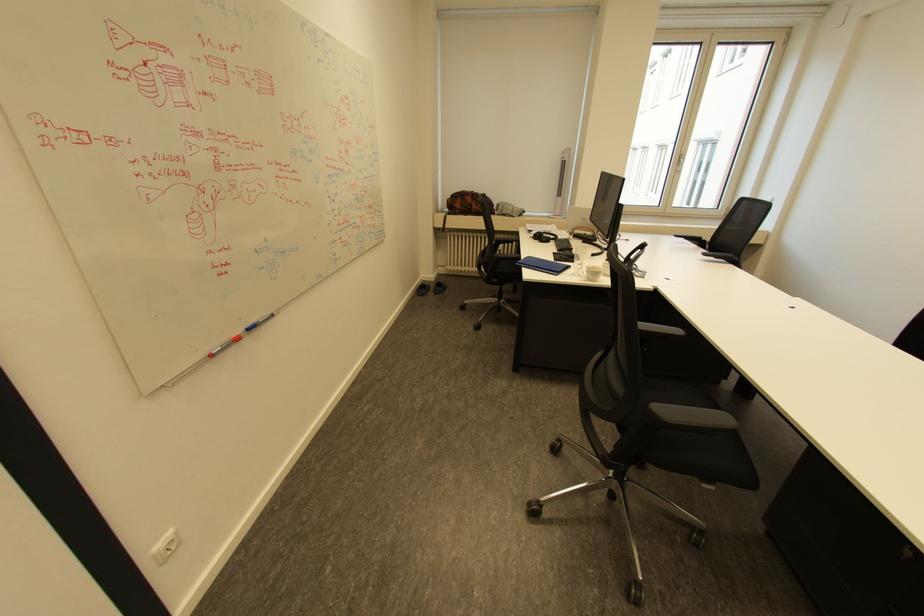
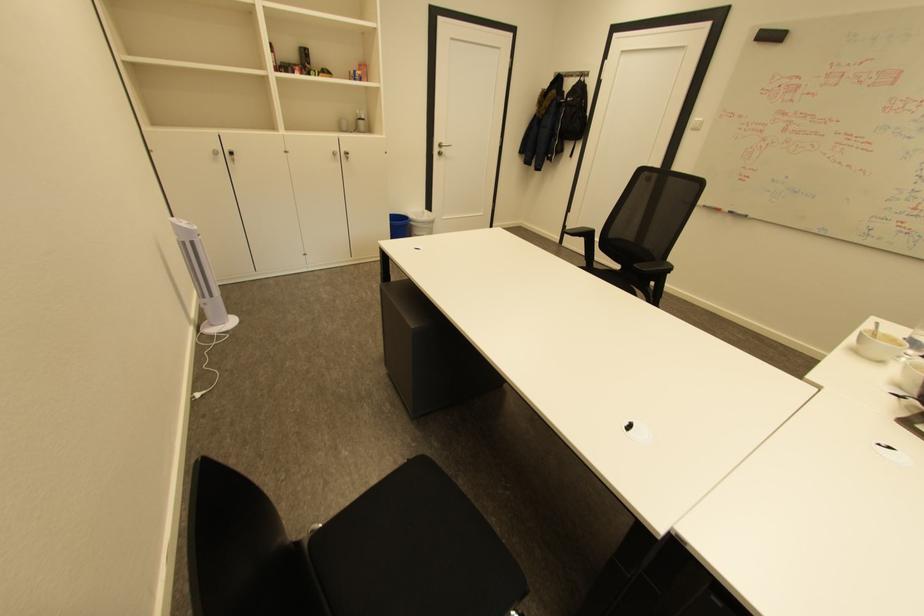
The point at (257, 329) is marked in the first image. Where is the corresponding point in the second image?

(737, 212)